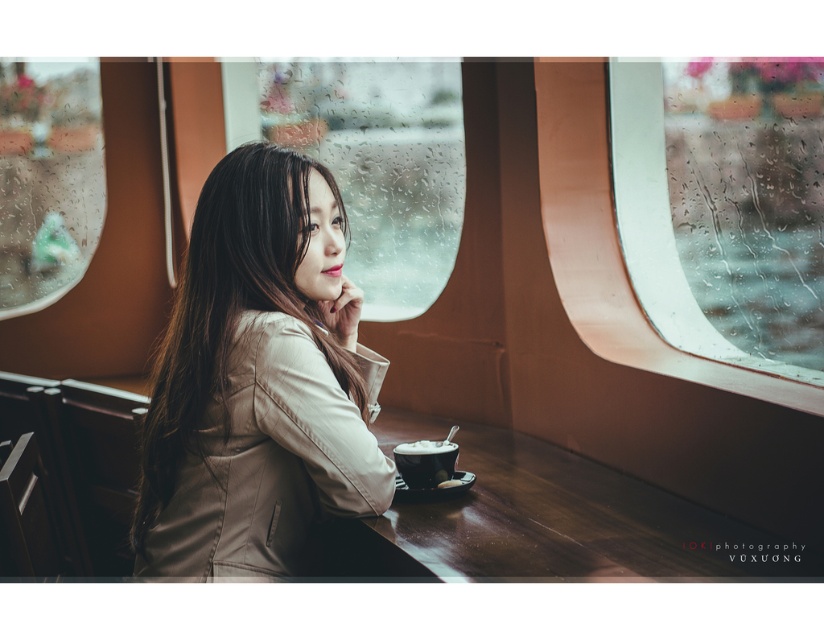
You are a barista who needs to prepare a cup of coffee for a customer seated by the transparent glass train window at center. The customer wants their coffee to be as large as the white frothy coffee at lower center. Can you provide a cup that fits the size requirement?

The transparent glass train window at center is bigger than the white frothy coffee at lower center, so the cup for the coffee must be smaller than the window. Since the customer wants the coffee to be as large as the existing white frothy coffee at lower center, the cup should match that size, which is smaller than the window, so yes, you can provide a cup that fits the size requirement.

You are a traveler sitting at the table in the boat. You want to place your white frothy coffee at lower center on the table without blocking the view through the transparent glass train window at center. Is the coffee small enough to fit on the table without covering the window?

The transparent glass train window at center is wider than the white frothy coffee at lower center, so placing the white frothy coffee at lower center on the table won

You are standing in the boat and want to reach the point marked at coordinates (x=347, y=502). Your arm can extend 1.2 meters. Can you reach that point without moving your feet?

The distance between you and the point marked at coordinates (x=347, y=502) is 1.32 meters. Since your arm can only extend 1.2 meters, you cannot reach it without moving your feet.